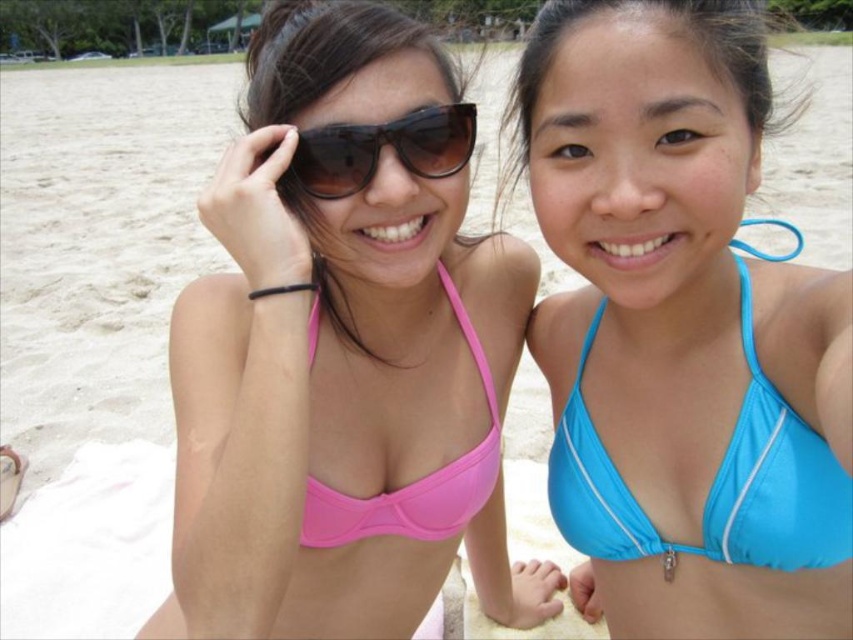
Which of these two, pink matte bikini top at upper left or blue matte bikini top at right, stands shorter?

With less height is blue matte bikini top at right.

Looking at this image, between pink matte bikini top at upper left and blue matte bikini top at right, which one has more height?

With more height is pink matte bikini top at upper left.

Image resolution: width=853 pixels, height=640 pixels. What are the coordinates of `pink matte bikini top at upper left` in the screenshot? It's located at (338, 355).

What do you see at coordinates (682, 332) in the screenshot? The height and width of the screenshot is (640, 853). I see `blue shiny bikini top at center` at bounding box center [682, 332].

At what (x,y) coordinates should I click in order to perform the action: click on blue shiny bikini top at center. Please return your answer as a coordinate pair (x, y). Image resolution: width=853 pixels, height=640 pixels. Looking at the image, I should click on (682, 332).

Where is `blue shiny bikini top at center`? The width and height of the screenshot is (853, 640). blue shiny bikini top at center is located at coordinates (682, 332).

Locate an element on the screen. The image size is (853, 640). blue shiny bikini top at center is located at coordinates (682, 332).

Between blue matte bikini top at right and black matte sunglasses at center, which one is positioned higher?

black matte sunglasses at center is higher up.

Is point (793, 476) positioned after point (308, 164)?

No, it is not.

Between point (747, 280) and point (314, 154), which one is positioned behind?

The point (747, 280) is behind.

Where is `blue matte bikini top at right`? This screenshot has height=640, width=853. blue matte bikini top at right is located at coordinates (712, 481).